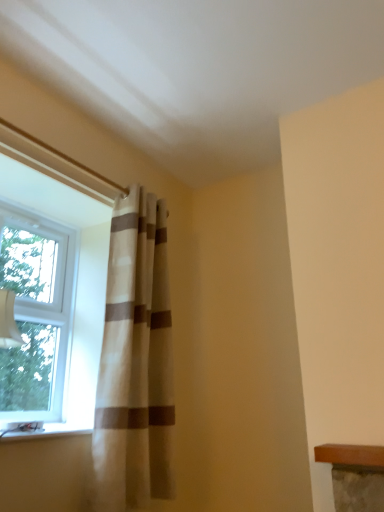
Question: Considering the relative sizes of white glossy window sill at lower left and beige textured curtain at left in the image provided, is white glossy window sill at lower left taller than beige textured curtain at left?

Choices:
 (A) no
 (B) yes

Answer: (A)

Question: Considering the relative sizes of white glossy window sill at lower left and beige textured curtain at left in the image provided, is white glossy window sill at lower left bigger than beige textured curtain at left?

Choices:
 (A) no
 (B) yes

Answer: (A)

Question: Is there a large distance between white glossy window sill at lower left and beige textured curtain at left?

Choices:
 (A) no
 (B) yes

Answer: (A)

Question: From the image's perspective, is white glossy window sill at lower left beneath beige textured curtain at left?

Choices:
 (A) no
 (B) yes

Answer: (B)

Question: Is the depth of white glossy window sill at lower left less than that of beige textured curtain at left?

Choices:
 (A) no
 (B) yes

Answer: (B)

Question: From a real-world perspective, is white glossy window sill at lower left under beige textured curtain at left?

Choices:
 (A) yes
 (B) no

Answer: (A)

Question: From the image's perspective, does clear glass window at left appear lower than beige textured curtain at left?

Choices:
 (A) no
 (B) yes

Answer: (A)

Question: Is the position of clear glass window at left more distant than that of beige textured curtain at left?

Choices:
 (A) yes
 (B) no

Answer: (A)

Question: From a real-world perspective, is clear glass window at left positioned over beige textured curtain at left based on gravity?

Choices:
 (A) yes
 (B) no

Answer: (A)

Question: Is clear glass window at left not close to beige textured curtain at left?

Choices:
 (A) no
 (B) yes

Answer: (A)

Question: Is clear glass window at left oriented towards beige textured curtain at left?

Choices:
 (A) no
 (B) yes

Answer: (B)

Question: Considering the relative positions of clear glass window at left and beige textured curtain at left in the image provided, is clear glass window at left in front of beige textured curtain at left?

Choices:
 (A) no
 (B) yes

Answer: (A)

Question: From the image's perspective, is clear glass window at left over white glossy window sill at lower left?

Choices:
 (A) no
 (B) yes

Answer: (B)